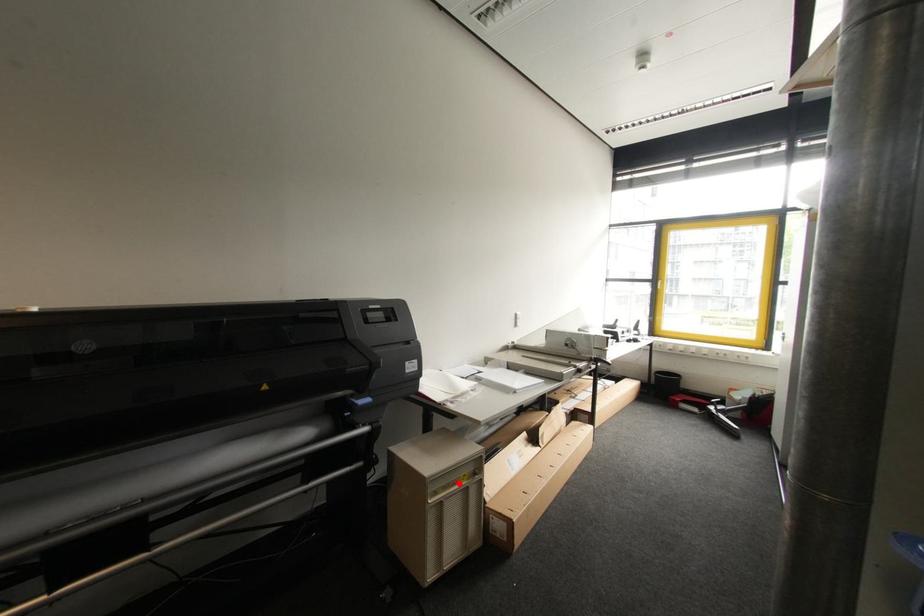
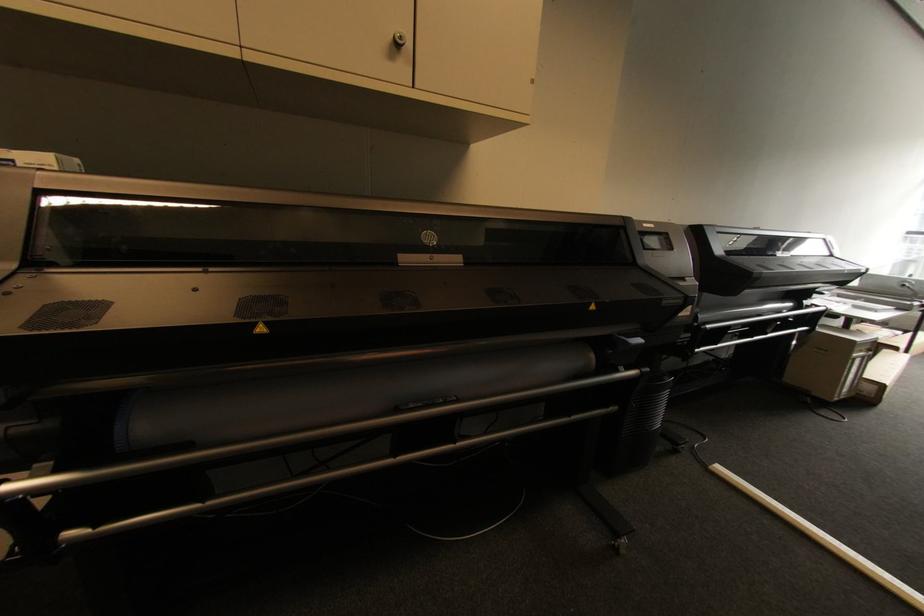
Find the pixel in the second image that matches the highlighted location in the first image.

(867, 352)